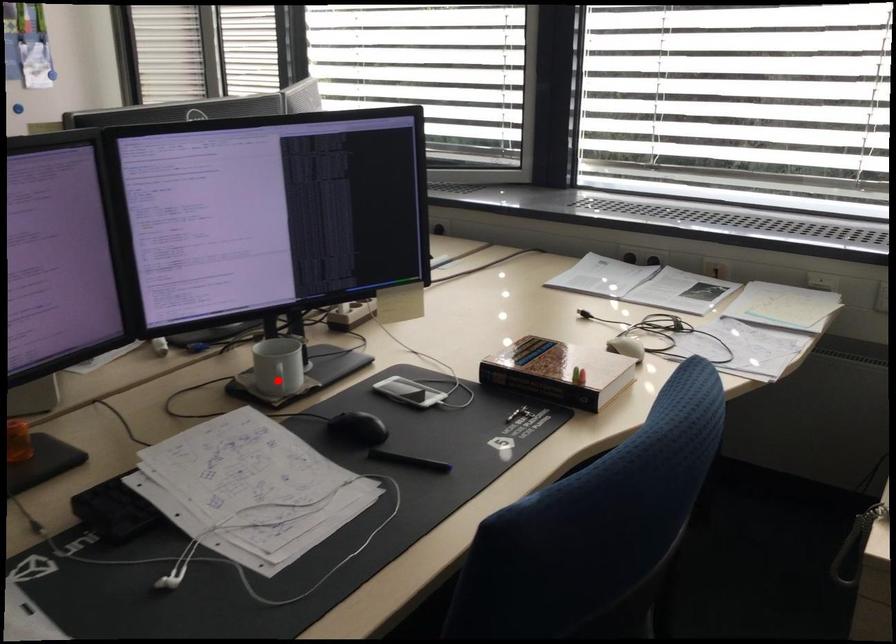
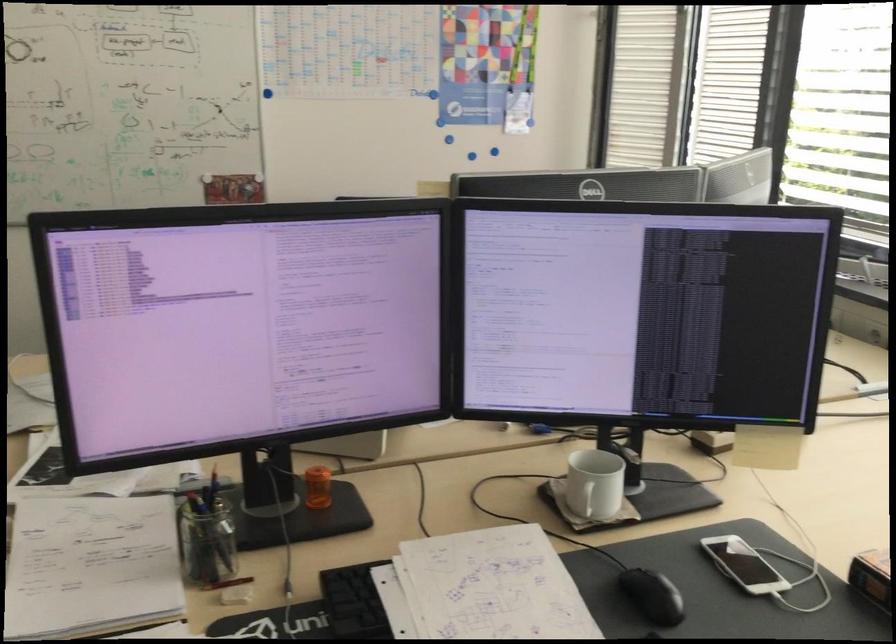
Find the pixel in the second image that matches the highlighted location in the first image.

(583, 498)